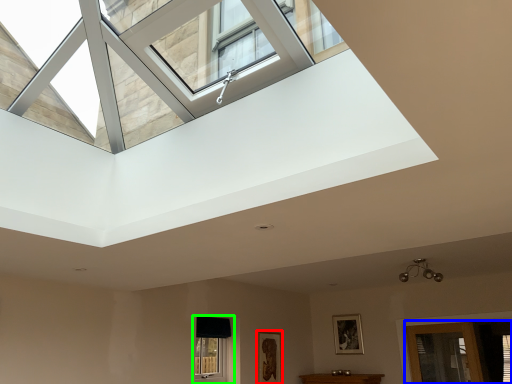
Question: Which object is positioned closest to picture frame (highlighted by a red box)? Select from glass door (highlighted by a blue box) and window (highlighted by a green box).

Choices:
 (A) glass door
 (B) window

Answer: (B)